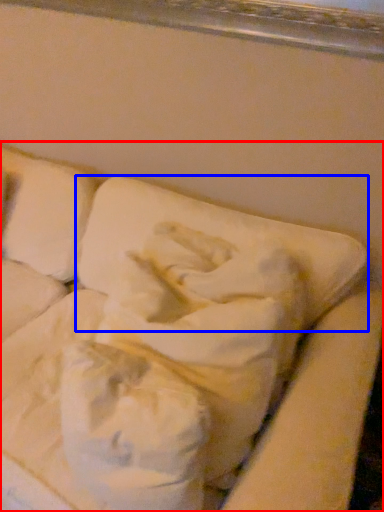
Question: Which point is closer to the camera, furniture (highlighted by a red box) or pillow (highlighted by a blue box)?

Choices:
 (A) furniture
 (B) pillow

Answer: (A)